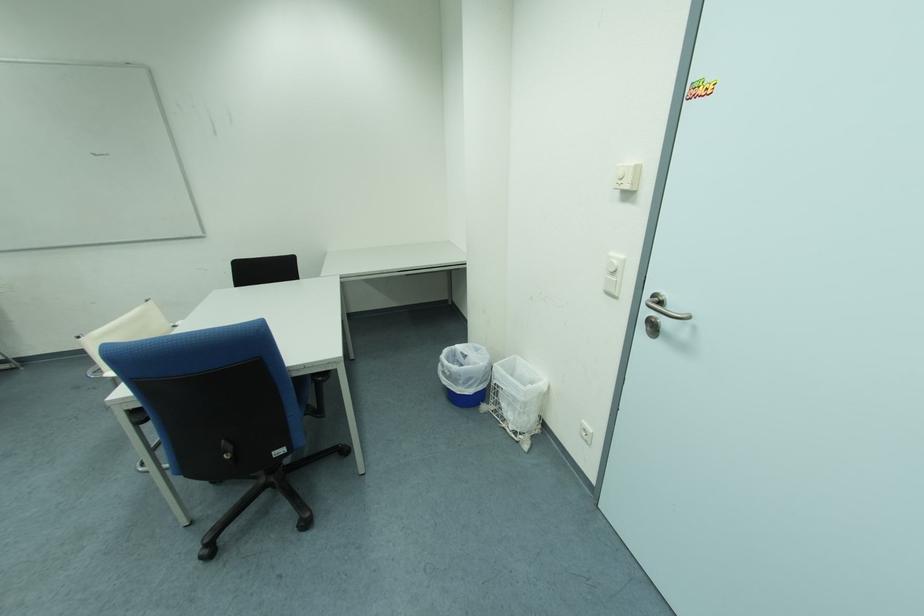
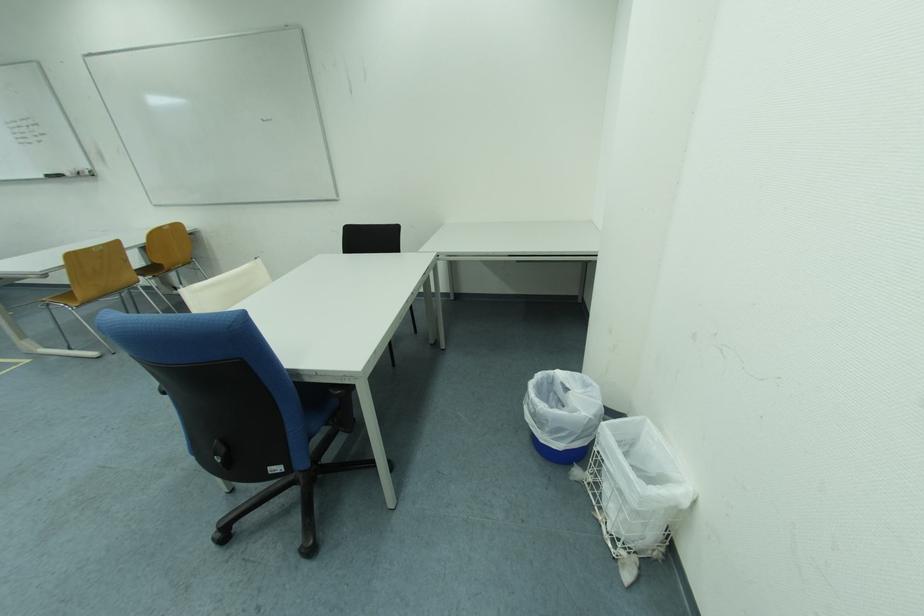
Question: The camera is either moving clockwise (left) or counter-clockwise (right) around the object. The first image is from the beginning of the video and the second image is from the end. Is the camera moving left or right when shooting the video?

Choices:
 (A) Left
 (B) Right

Answer: (B)